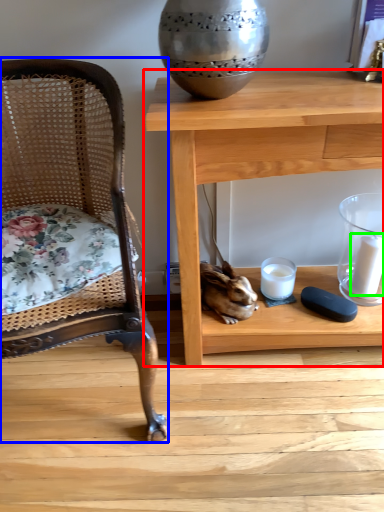
Question: Which is nearer to the table (highlighted by a red box)? chair (highlighted by a blue box) or candle (highlighted by a green box).

Choices:
 (A) chair
 (B) candle

Answer: (A)